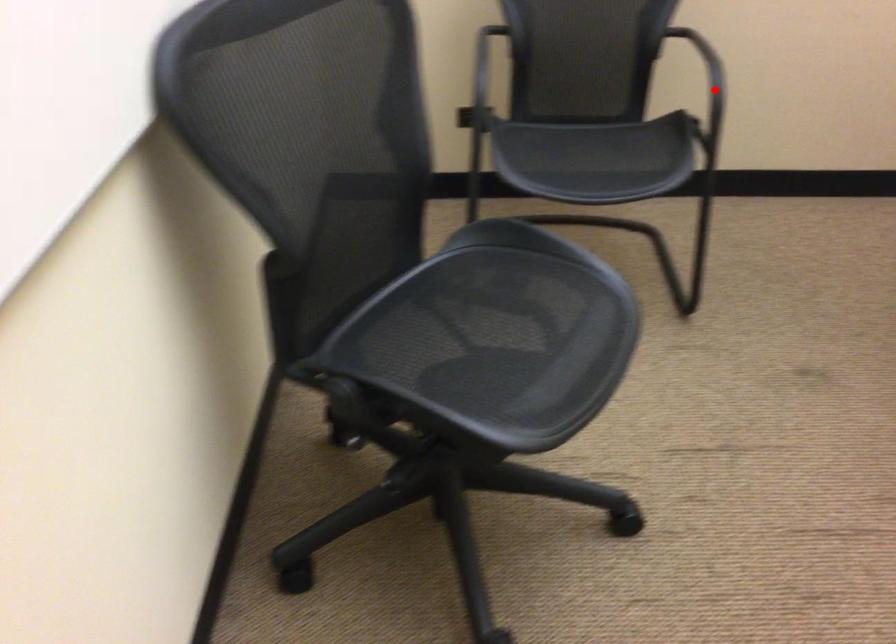
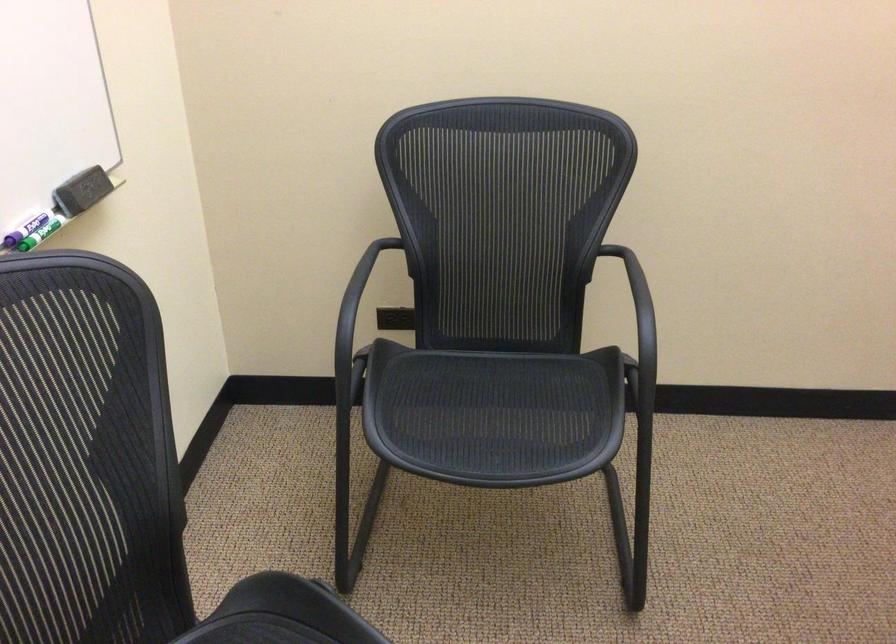
Question: I am providing you with two images of the same scene from different viewpoints. Given a red point in image1, look at the same physical point in image2. Is it:

Choices:
 (A) Closer to the viewpoint
 (B) Farther from the viewpoint

Answer: (A)